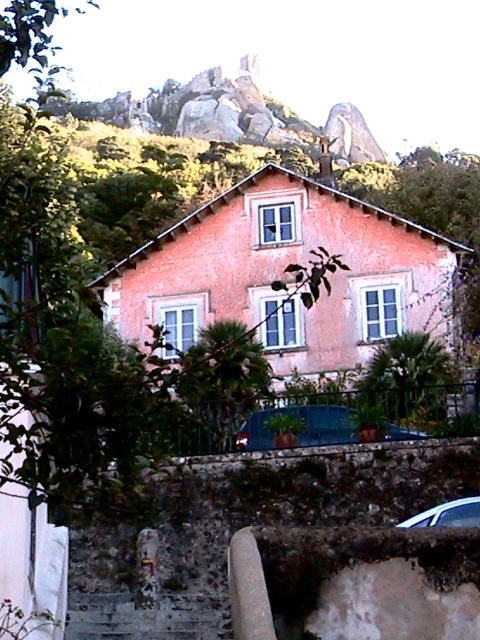
Can you confirm if metallic blue car at lower center is positioned above satin silver car at lower right?

Indeed, metallic blue car at lower center is positioned over satin silver car at lower right.

Can you confirm if metallic blue car at lower center is shorter than satin silver car at lower right?

Indeed, metallic blue car at lower center has a lesser height compared to satin silver car at lower right.

Is point (325, 413) positioned after point (468, 524)?

That is True.

This screenshot has width=480, height=640. I want to click on metallic blue car at lower center, so click(300, 426).